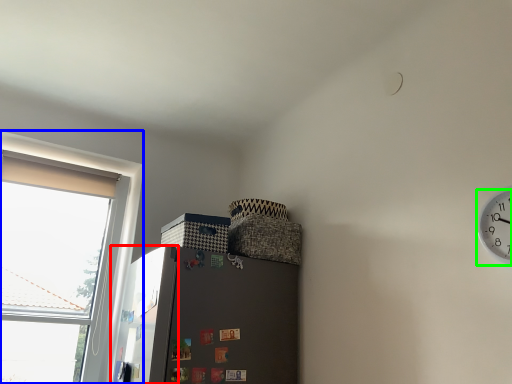
Question: Based on their relative distances, which object is nearer to screen door (highlighted by a red box)? Choose from window (highlighted by a blue box) and clock (highlighted by a green box).

Choices:
 (A) window
 (B) clock

Answer: (A)